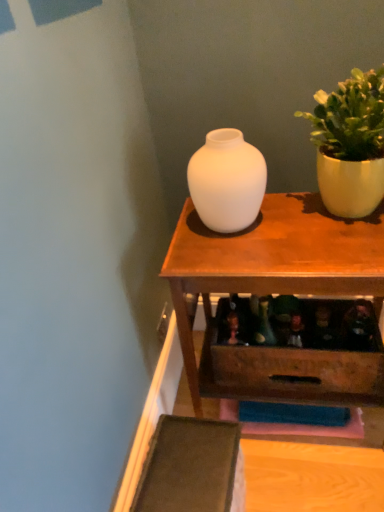
The image size is (384, 512). Identify the location of blank space situated above matte wood table at center (from a real-world perspective). (266, 233).